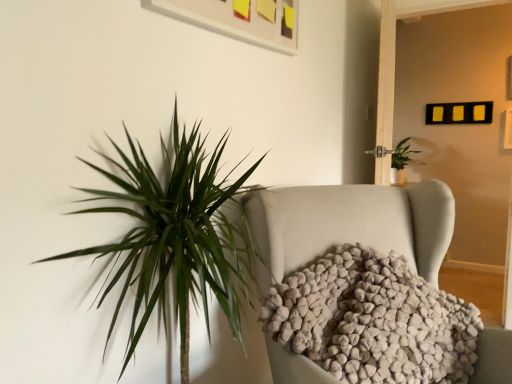
Where is `white fuzzy blanket at center`? Image resolution: width=512 pixels, height=384 pixels. white fuzzy blanket at center is located at coordinates (351, 223).

The image size is (512, 384). What do you see at coordinates (351, 223) in the screenshot?
I see `white fuzzy blanket at center` at bounding box center [351, 223].

This screenshot has width=512, height=384. What do you see at coordinates (401, 161) in the screenshot?
I see `green leafy plant at upper right` at bounding box center [401, 161].

Locate an element on the screen. The image size is (512, 384). green leafy plant at upper right is located at coordinates (401, 161).

You are a GUI agent. You are given a task and a screenshot of the screen. Output one action in this format:
    pyautogui.click(x=<x>, y=<y>)
    Task: Click on the white fuzzy blanket at center
    This screenshot has height=384, width=512.
    Given the screenshot: What is the action you would take?
    pyautogui.click(x=351, y=223)

Is green leafy plant at upper right to the left or to the right of white fuzzy blanket at center in the image?

In the image, green leafy plant at upper right appears on the right side of white fuzzy blanket at center.

Who is more distant, green leafy plant at upper right or white fuzzy blanket at center?

green leafy plant at upper right is behind.

Considering the positions of point (399, 156) and point (440, 219), is point (399, 156) closer or farther from the camera than point (440, 219)?

Clearly, point (399, 156) is more distant from the camera than point (440, 219).

From the image's perspective, does green leafy plant at upper right appear lower than white fuzzy blanket at center?

Actually, green leafy plant at upper right appears above white fuzzy blanket at center in the image.

From a real-world perspective, is green leafy plant at upper right under white fuzzy blanket at center?

No, from a real-world perspective, green leafy plant at upper right is not under white fuzzy blanket at center.

Is green leafy plant at upper right thinner than white fuzzy blanket at center?

Incorrect, the width of green leafy plant at upper right is not less than that of white fuzzy blanket at center.

Considering the sizes of objects green leafy plant at upper right and white fuzzy blanket at center in the image provided, who is taller, green leafy plant at upper right or white fuzzy blanket at center?

With more height is white fuzzy blanket at center.

Is green leafy plant at upper right bigger than white fuzzy blanket at center?

Incorrect, green leafy plant at upper right is not larger than white fuzzy blanket at center.

Is green leafy plant at upper right inside or outside of white fuzzy blanket at center?

The correct answer is: outside.

Is green leafy plant at upper right not close to white fuzzy blanket at center?

Yes, green leafy plant at upper right is far from white fuzzy blanket at center.

Is green leafy plant at upper right positioned with its back to white fuzzy blanket at center?

No, white fuzzy blanket at center is not at the back of green leafy plant at upper right.

What's the angular difference between green leafy plant at upper right and white fuzzy blanket at center's facing directions?

49.4 degrees.

At what (x,y) coordinates should I click in order to perform the action: click on houseplant that is above the white fuzzy blanket at center (from a real-world perspective). Please return your answer as a coordinate pair (x, y). Looking at the image, I should click on (401, 161).

Does white fuzzy blanket at center appear on the right side of green leafy plant at upper right?

Incorrect, white fuzzy blanket at center is not on the right side of green leafy plant at upper right.

Which object is closer to the camera, white fuzzy blanket at center or green leafy plant at upper right?

white fuzzy blanket at center.

Which is in front, point (330, 203) or point (394, 160)?

Positioned in front is point (330, 203).

From the image's perspective, which object appears higher, white fuzzy blanket at center or green leafy plant at upper right?

green leafy plant at upper right is shown above in the image.

From a real-world perspective, is white fuzzy blanket at center on top of green leafy plant at upper right?

Incorrect, from a real-world perspective, white fuzzy blanket at center is lower than green leafy plant at upper right.

Considering the sizes of objects white fuzzy blanket at center and green leafy plant at upper right in the image provided, who is wider, white fuzzy blanket at center or green leafy plant at upper right?

With larger width is green leafy plant at upper right.

Can you confirm if white fuzzy blanket at center is shorter than green leafy plant at upper right?

In fact, white fuzzy blanket at center may be taller than green leafy plant at upper right.

Who is smaller, white fuzzy blanket at center or green leafy plant at upper right?

green leafy plant at upper right.

Is green leafy plant at upper right inside white fuzzy blanket at center?

Actually, green leafy plant at upper right is outside white fuzzy blanket at center.

Is white fuzzy blanket at center positioned far away from green leafy plant at upper right?

white fuzzy blanket at center is far away from green leafy plant at upper right.

Could you tell me if white fuzzy blanket at center is turned towards green leafy plant at upper right?

No, white fuzzy blanket at center is not facing towards green leafy plant at upper right.

How different are the orientations of white fuzzy blanket at center and green leafy plant at upper right in degrees?

The facing directions of white fuzzy blanket at center and green leafy plant at upper right are 49.4 degrees apart.

Where is `furniture on the left of green leafy plant at upper right`? furniture on the left of green leafy plant at upper right is located at coordinates (351, 223).

Locate an element on the screen. The width and height of the screenshot is (512, 384). houseplant behind the white fuzzy blanket at center is located at coordinates (401, 161).

Image resolution: width=512 pixels, height=384 pixels. What are the coordinates of `furniture lying in front of the green leafy plant at upper right` in the screenshot? It's located at (351, 223).